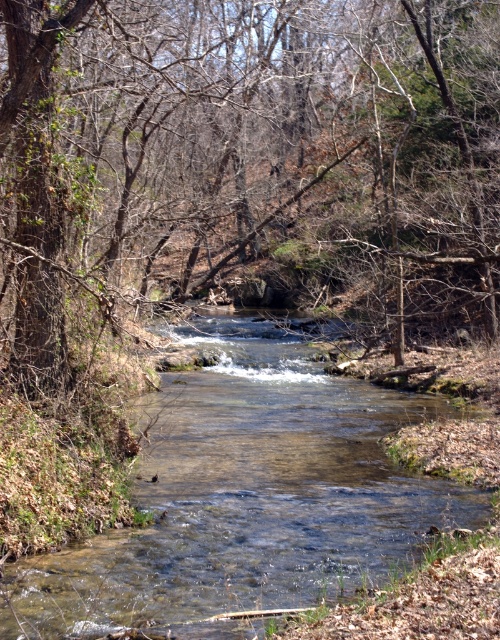
Question: Is brown wood tree at center bigger than clear water at center?

Choices:
 (A) no
 (B) yes

Answer: (B)

Question: Which of the following is the farthest from the observer?

Choices:
 (A) brown wood tree at center
 (B) clear water at center

Answer: (A)

Question: Can you confirm if brown wood tree at center is positioned to the left of clear water at center?

Choices:
 (A) yes
 (B) no

Answer: (B)

Question: Does brown wood tree at center appear on the right side of clear water at center?

Choices:
 (A) no
 (B) yes

Answer: (B)

Question: Which point is closer to the camera?

Choices:
 (A) clear water at center
 (B) brown wood tree at center

Answer: (A)